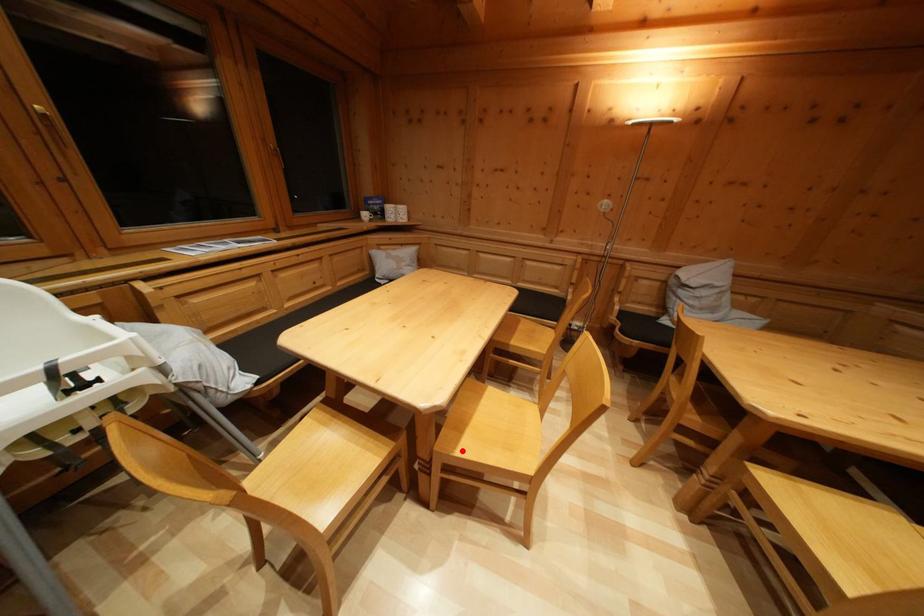
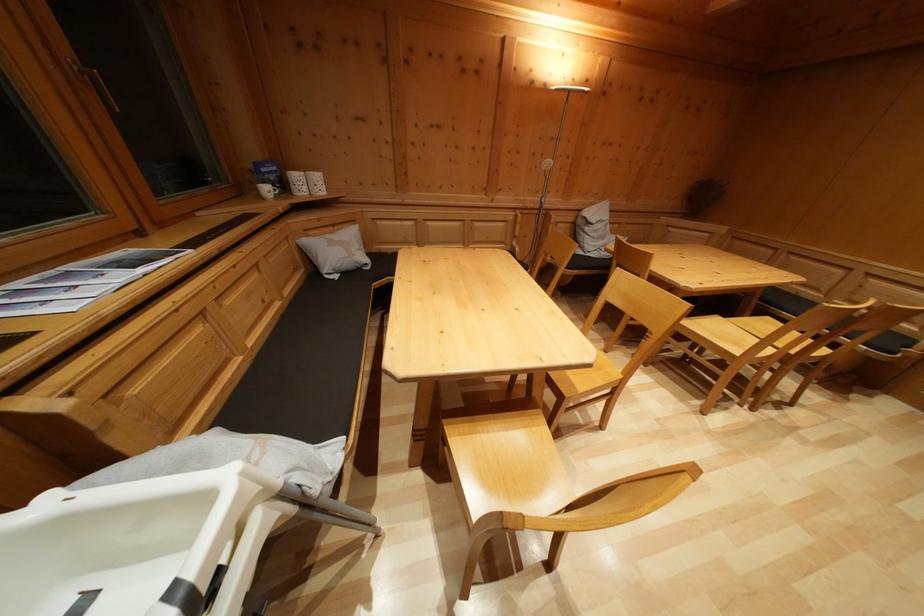
Question: I am providing you with two images of the same scene from different viewpoints. Image1 has a red point marked. In image2, the corresponding 3D location appears at what relative position? Reply with the corresponding letter.

Choices:
 (A) Closer
 (B) Farther

Answer: (B)